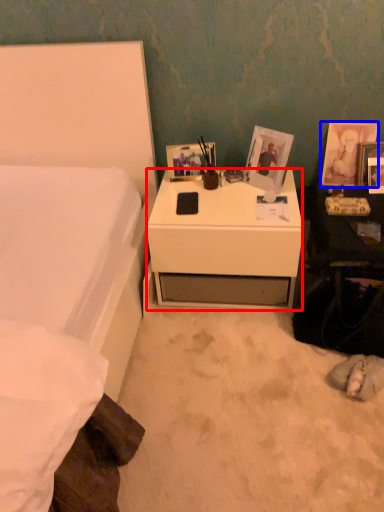
Question: Among these objects, which one is farthest to the camera, desk (highlighted by a red box) or picture frame (highlighted by a blue box)?

Choices:
 (A) desk
 (B) picture frame

Answer: (B)